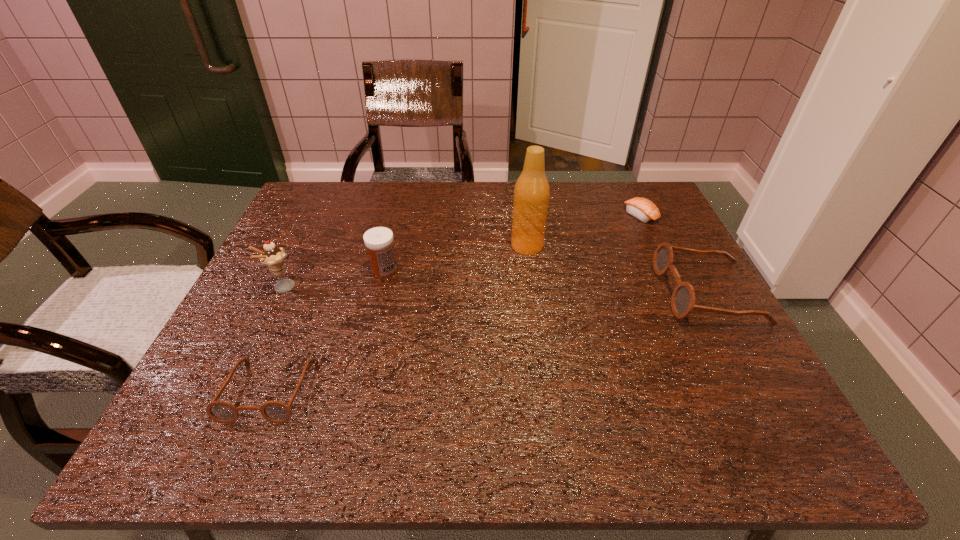
Locate an element on the screen. the second shortest object is located at coordinates (277, 412).

The width and height of the screenshot is (960, 540). Identify the location of the nearest object. (277, 412).

Image resolution: width=960 pixels, height=540 pixels. I want to click on the third shortest object, so click(683, 298).

Identify the location of the farther spectacles. The image size is (960, 540). [683, 298].

This screenshot has width=960, height=540. What are the coordinates of `sushi` in the screenshot? It's located at (643, 209).

Find the location of a particular element. The width and height of the screenshot is (960, 540). the farthest object is located at coordinates (643, 209).

Locate an element on the screen. the fifth shortest object is located at coordinates (273, 257).

Where is `the fifth nearest object`? The width and height of the screenshot is (960, 540). the fifth nearest object is located at coordinates (531, 193).

Locate an element on the screen. The image size is (960, 540). the fourth object from left to right is located at coordinates (531, 193).

Identify the location of medicine. (379, 241).